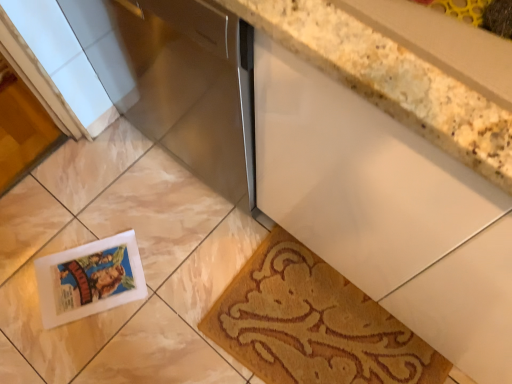
Where is `vacant region in front of white glossy postcard at lower left`? Image resolution: width=512 pixels, height=384 pixels. vacant region in front of white glossy postcard at lower left is located at coordinates (84, 344).